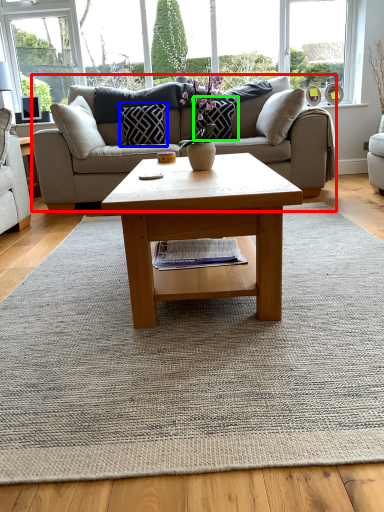
Question: Estimate the real-world distances between objects in this image. Which object is closer to studio couch (highlighted by a red box), pillow (highlighted by a blue box) or pillow (highlighted by a green box)?

Choices:
 (A) pillow
 (B) pillow

Answer: (A)